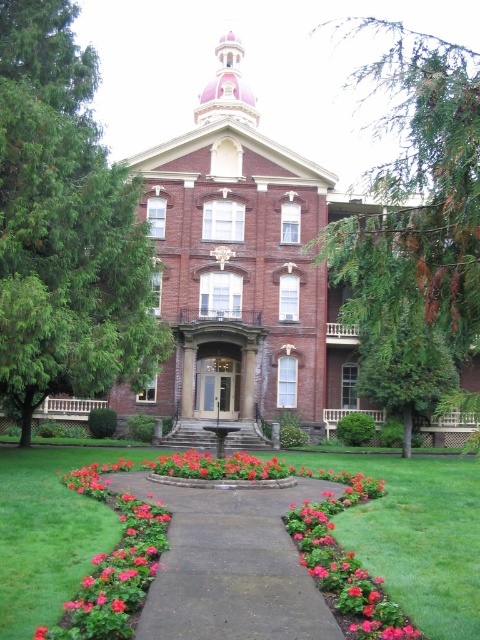
Question: From the image, what is the correct spatial relationship of green grass at center in relation to green leafy tree at upper right?

Choices:
 (A) above
 (B) below

Answer: (B)

Question: Which point is farther from the camera taking this photo?

Choices:
 (A) (71, 355)
 (B) (186, 476)
 (C) (26, 621)
 (D) (373, 273)

Answer: (A)

Question: Can you confirm if green leafy tree at upper right is positioned below pink matte flower bed at center?

Choices:
 (A) no
 (B) yes

Answer: (A)

Question: Which object is farther from the camera taking this photo?

Choices:
 (A) smooth glossy flower at center
 (B) green leafy tree at upper right

Answer: (B)

Question: Which point is farther to the camera?

Choices:
 (A) (201, 605)
 (B) (88, 120)
 (C) (113, 600)
 (D) (254, 470)

Answer: (B)

Question: Considering the relative positions of green leafy tree at left and green grass at center in the image provided, where is green leafy tree at left located with respect to green grass at center?

Choices:
 (A) right
 (B) left

Answer: (B)